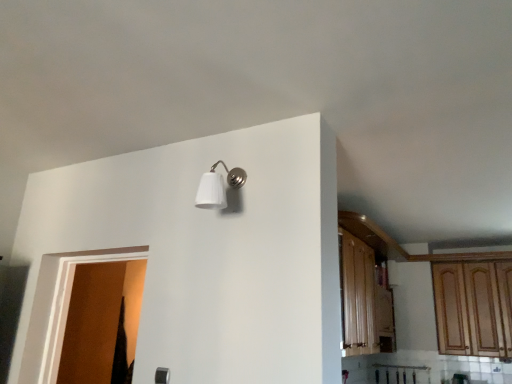
Question: Could you tell me if wooden cabinet at right is turned towards brown matte door at left?

Choices:
 (A) yes
 (B) no

Answer: (B)

Question: Considering the relative sizes of wooden cabinet at right and brown matte door at left in the image provided, is wooden cabinet at right bigger than brown matte door at left?

Choices:
 (A) yes
 (B) no

Answer: (A)

Question: Does wooden cabinet at right appear on the left side of brown matte door at left?

Choices:
 (A) yes
 (B) no

Answer: (B)

Question: Can you confirm if wooden cabinet at right is taller than brown matte door at left?

Choices:
 (A) no
 (B) yes

Answer: (B)

Question: Considering the relative sizes of wooden cabinet at right and brown matte door at left in the image provided, is wooden cabinet at right thinner than brown matte door at left?

Choices:
 (A) yes
 (B) no

Answer: (A)

Question: Is white matte wall sconce at upper center to the left or to the right of brown matte door at left in the image?

Choices:
 (A) left
 (B) right

Answer: (B)

Question: Is white matte wall sconce at upper center wider or thinner than brown matte door at left?

Choices:
 (A) wide
 (B) thin

Answer: (B)

Question: From the image's perspective, relative to brown matte door at left, is white matte wall sconce at upper center above or below?

Choices:
 (A) below
 (B) above

Answer: (B)

Question: From a real-world perspective, relative to brown matte door at left, is white matte wall sconce at upper center vertically above or below?

Choices:
 (A) above
 (B) below

Answer: (A)

Question: From the image's perspective, is brown matte door at left above or below wooden cabinet at right?

Choices:
 (A) below
 (B) above

Answer: (B)

Question: From a real-world perspective, is brown matte door at left positioned above or below wooden cabinet at right?

Choices:
 (A) below
 (B) above

Answer: (A)

Question: Is brown matte door at left bigger or smaller than wooden cabinet at right?

Choices:
 (A) big
 (B) small

Answer: (B)

Question: Considering their positions, is brown matte door at left located in front of or behind wooden cabinet at right?

Choices:
 (A) behind
 (B) front

Answer: (B)

Question: From the image's perspective, is brown matte door at left located above or below white matte wall sconce at upper center?

Choices:
 (A) above
 (B) below

Answer: (B)

Question: Considering the positions of point (56, 284) and point (215, 188), is point (56, 284) closer or farther from the camera than point (215, 188)?

Choices:
 (A) closer
 (B) farther

Answer: (B)